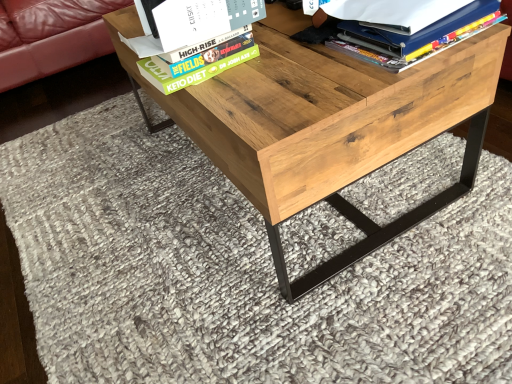
Question: Can you confirm if matte blue folder at upper right is taller than hardcover book at upper center?

Choices:
 (A) no
 (B) yes

Answer: (B)

Question: Can we say matte blue folder at upper right lies outside hardcover book at upper center?

Choices:
 (A) no
 (B) yes

Answer: (B)

Question: Can hardcover book at upper center be found inside matte blue folder at upper right?

Choices:
 (A) yes
 (B) no

Answer: (B)

Question: Considering the relative positions of matte blue folder at upper right and hardcover book at upper center in the image provided, is matte blue folder at upper right to the left of hardcover book at upper center from the viewer's perspective?

Choices:
 (A) no
 (B) yes

Answer: (A)

Question: From the image's perspective, is matte blue folder at upper right located above hardcover book at upper center?

Choices:
 (A) yes
 (B) no

Answer: (A)

Question: Is matte blue folder at upper right facing away from hardcover book at upper center?

Choices:
 (A) yes
 (B) no

Answer: (A)

Question: Is matte blue folder at upper right at the right side of natural wood table at center?

Choices:
 (A) yes
 (B) no

Answer: (A)

Question: Is matte blue folder at upper right wider than natural wood table at center?

Choices:
 (A) yes
 (B) no

Answer: (B)

Question: Is matte blue folder at upper right facing away from natural wood table at center?

Choices:
 (A) yes
 (B) no

Answer: (B)

Question: Can you confirm if matte blue folder at upper right is smaller than natural wood table at center?

Choices:
 (A) yes
 (B) no

Answer: (A)

Question: Does matte blue folder at upper right have a larger size compared to natural wood table at center?

Choices:
 (A) yes
 (B) no

Answer: (B)

Question: From the image's perspective, does matte blue folder at upper right appear higher than natural wood table at center?

Choices:
 (A) no
 (B) yes

Answer: (B)

Question: Does hardcover book at upper center have a lesser height compared to natural wood table at center?

Choices:
 (A) no
 (B) yes

Answer: (B)